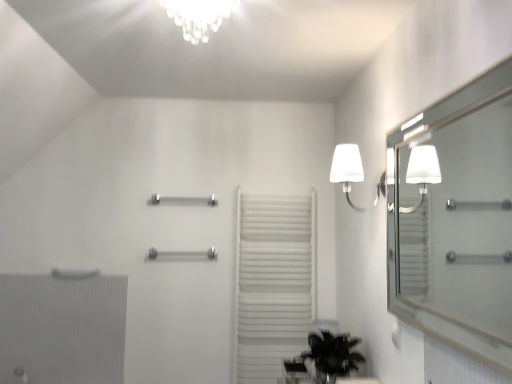
What do you see at coordinates (357, 380) in the screenshot?
I see `white glossy countertop at lower center` at bounding box center [357, 380].

Describe the element at coordinates (459, 221) in the screenshot. Image resolution: width=512 pixels, height=384 pixels. I see `silver/metallic mirror at right` at that location.

The image size is (512, 384). Describe the element at coordinates (183, 199) in the screenshot. I see `polished chrome towel bar at center, the first towel bar viewed from the top` at that location.

In order to click on green leafy plant at lower center in this screenshot , I will do pyautogui.click(x=333, y=355).

What are the coordinates of `white glossy countertop at lower center` in the screenshot? It's located at (357, 380).

From the image's perspective, does silver/metallic mirror at right appear lower than polished chrome towel bar at center, the first towel bar viewed from the top?

Yes, from the image's perspective, silver/metallic mirror at right is below polished chrome towel bar at center, the first towel bar viewed from the top.

Does silver/metallic mirror at right have a lesser width compared to polished chrome towel bar at center, positioned as the 2th towel bar in bottom-to-top order?

Correct, the width of silver/metallic mirror at right is less than that of polished chrome towel bar at center, positioned as the 2th towel bar in bottom-to-top order.

From a real-world perspective, is silver/metallic mirror at right below polished chrome towel bar at center, positioned as the 2th towel bar in bottom-to-top order?

Indeed, from a real-world perspective, silver/metallic mirror at right is positioned beneath polished chrome towel bar at center, positioned as the 2th towel bar in bottom-to-top order.

Does green leafy plant at lower center come in front of white glossy countertop at lower center?

That is False.

From a real-world perspective, relative to white glossy countertop at lower center, is green leafy plant at lower center vertically above or below?

In terms of real-world spatial position, green leafy plant at lower center is above white glossy countertop at lower center.

Looking at this image, considering the positions of objects green leafy plant at lower center and white glossy countertop at lower center in the image provided, who is more to the right, green leafy plant at lower center or white glossy countertop at lower center?

Positioned to the right is white glossy countertop at lower center.

Which of these two, green leafy plant at lower center or white glossy countertop at lower center, is bigger?

green leafy plant at lower center is bigger.

Is green leafy plant at lower center taller or shorter than polished chrome towel bar at center, acting as the second towel bar starting from the top?

green leafy plant at lower center is taller than polished chrome towel bar at center, acting as the second towel bar starting from the top.

Is green leafy plant at lower center behind polished chrome towel bar at center, arranged as the 1th towel bar when ordered from the bottom?

No, green leafy plant at lower center is closer to the camera.

At what (x,y) coordinates should I click in order to perform the action: click on houseplant below the polished chrome towel bar at center, acting as the second towel bar starting from the top (from the image's perspective). Please return your answer as a coordinate pair (x, y). This screenshot has width=512, height=384. Looking at the image, I should click on (333, 355).

From the image's perspective, is green leafy plant at lower center on top of polished chrome towel bar at center, acting as the second towel bar starting from the top?

Actually, green leafy plant at lower center appears below polished chrome towel bar at center, acting as the second towel bar starting from the top, in the image.

Could you tell me if polished chrome towel bar at center, positioned as the 2th towel bar in bottom-to-top order, is facing white glossy countertop at lower center?

No, polished chrome towel bar at center, positioned as the 2th towel bar in bottom-to-top order, is not facing towards white glossy countertop at lower center.

Is the surface of polished chrome towel bar at center, positioned as the 2th towel bar in bottom-to-top order, in direct contact with white glossy countertop at lower center?

No, polished chrome towel bar at center, positioned as the 2th towel bar in bottom-to-top order, is not in contact with white glossy countertop at lower center.

From the image's perspective, between polished chrome towel bar at center, the first towel bar viewed from the top, and white glossy countertop at lower center, which one is located above?

polished chrome towel bar at center, the first towel bar viewed from the top, is shown above in the image.

From a real-world perspective, does green leafy plant at lower center stand above silver/metallic mirror at right?

No, from a real-world perspective, green leafy plant at lower center is not on top of silver/metallic mirror at right.

Is green leafy plant at lower center next to silver/metallic mirror at right?

No, green leafy plant at lower center is not beside silver/metallic mirror at right.

Who is shorter, green leafy plant at lower center or silver/metallic mirror at right?

green leafy plant at lower center.

Which object is wider, polished chrome towel bar at center, acting as the second towel bar starting from the top, or white textured radiator at lower left?

Wider between the two is polished chrome towel bar at center, acting as the second towel bar starting from the top.

Is polished chrome towel bar at center, acting as the second towel bar starting from the top, touching white textured radiator at lower left?

There is a gap between polished chrome towel bar at center, acting as the second towel bar starting from the top, and white textured radiator at lower left.

From their relative heights in the image, would you say polished chrome towel bar at center, acting as the second towel bar starting from the top, is taller or shorter than white textured radiator at lower left?

In the image, polished chrome towel bar at center, acting as the second towel bar starting from the top, appears to be shorter than white textured radiator at lower left.

Is polished chrome towel bar at center, acting as the second towel bar starting from the top, closer to the viewer compared to white textured radiator at lower left?

No, polished chrome towel bar at center, acting as the second towel bar starting from the top, is behind white textured radiator at lower left.

Is silver/metallic mirror at right next to white glossy countertop at lower center and touching it?

No, silver/metallic mirror at right is not beside white glossy countertop at lower center.

Is silver/metallic mirror at right in front of or behind white glossy countertop at lower center in the image?

silver/metallic mirror at right is in front of white glossy countertop at lower center.

Considering the sizes of silver/metallic mirror at right and white glossy countertop at lower center in the image, is silver/metallic mirror at right taller or shorter than white glossy countertop at lower center?

In the image, silver/metallic mirror at right appears to be taller than white glossy countertop at lower center.

At what (x,y) coordinates should I click in order to perform the action: click on mirror below the polished chrome towel bar at center, positioned as the 2th towel bar in bottom-to-top order (from the image's perspective). Please return your answer as a coordinate pair (x, y). The image size is (512, 384). Looking at the image, I should click on (459, 221).

In the image, there is a white glossy countertop at lower center. Where is `houseplant above it (from the image's perspective)`? houseplant above it (from the image's perspective) is located at coordinates (333, 355).

From the picture: Estimate the real-world distances between objects in this image. Which object is further from green leafy plant at lower center, white textured radiator at lower left or polished chrome towel bar at center, acting as the second towel bar starting from the top?

Based on the image, white textured radiator at lower left appears to be further to green leafy plant at lower center.

Estimate the real-world distances between objects in this image. Which object is further from polished chrome towel bar at center, the first towel bar viewed from the top, polished chrome towel bar at center, arranged as the 1th towel bar when ordered from the bottom, or white matte towel rack at center?

Among the two, white matte towel rack at center is located further to polished chrome towel bar at center, the first towel bar viewed from the top.

Looking at the image, which one is located further to green leafy plant at lower center, white glossy countertop at lower center or polished chrome towel bar at center, arranged as the 1th towel bar when ordered from the bottom?

polished chrome towel bar at center, arranged as the 1th towel bar when ordered from the bottom, lies further to green leafy plant at lower center than the other object.

Which object lies further to the anchor point green leafy plant at lower center, polished chrome towel bar at center, the first towel bar viewed from the top, or white glossy countertop at lower center?

The object further to green leafy plant at lower center is polished chrome towel bar at center, the first towel bar viewed from the top.

Considering their positions, is white fabric lamp at upper right positioned closer to white glossy countertop at lower center than white textured radiator at lower left?

white fabric lamp at upper right.

Considering their positions, is white glossy countertop at lower center positioned closer to white matte towel rack at center than silver/metallic mirror at right?

white glossy countertop at lower center is positioned closer to the anchor white matte towel rack at center.

Which object lies nearer to the anchor point silver/metallic mirror at right, polished chrome towel bar at center, positioned as the 2th towel bar in bottom-to-top order, or white textured radiator at lower left?

The object closer to silver/metallic mirror at right is polished chrome towel bar at center, positioned as the 2th towel bar in bottom-to-top order.

Looking at the image, which one is located further to white fabric lamp at upper right, silver/metallic mirror at right or white glossy countertop at lower center?

white glossy countertop at lower center.

Locate an element on the screen. lamp between white glossy countertop at lower center and polished chrome towel bar at center, positioned as the 2th towel bar in bottom-to-top order, from front to back is located at coordinates (351, 173).

At what (x,y) coordinates should I click in order to perform the action: click on curtain that lies between white fabric lamp at upper right and white glossy countertop at lower center from top to bottom. Please return your answer as a coordinate pair (x, y). The image size is (512, 384). Looking at the image, I should click on (273, 282).

Where is `mirror that lies between white fabric lamp at upper right and white glossy countertop at lower center from top to bottom`? mirror that lies between white fabric lamp at upper right and white glossy countertop at lower center from top to bottom is located at coordinates (459, 221).

This screenshot has width=512, height=384. I want to click on curtain located between silver/metallic mirror at right and polished chrome towel bar at center, positioned as the 2th towel bar in bottom-to-top order, in the depth direction, so click(273, 282).